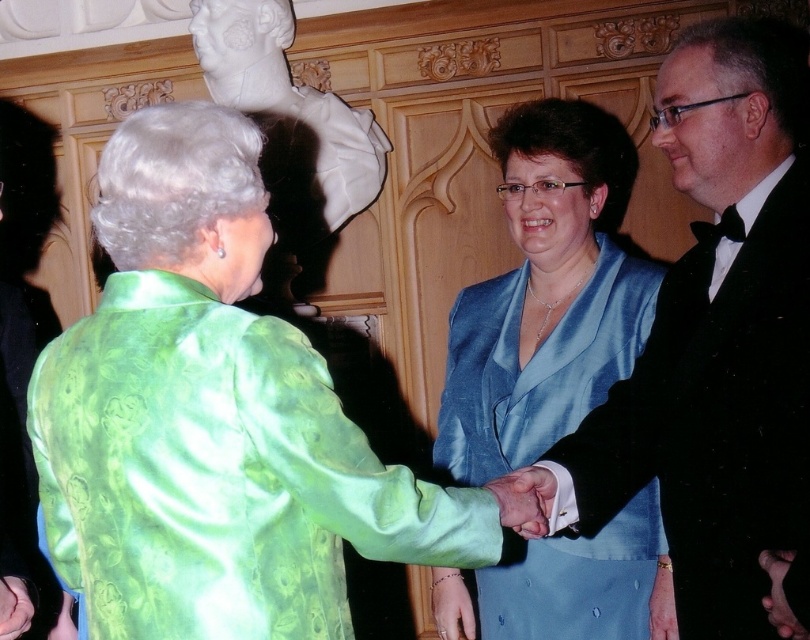
Does dark skin hand at lower right have a smaller size compared to smooth skin hand at lower left?

Correct, dark skin hand at lower right occupies less space than smooth skin hand at lower left.

Who is higher up, dark skin hand at lower right or smooth skin hand at lower left?

dark skin hand at lower right

This screenshot has width=810, height=640. In order to click on dark skin hand at lower right in this screenshot , I will do coord(779,595).

You are a GUI agent. You are given a task and a screenshot of the screen. Output one action in this format:
    pyautogui.click(x=<x>, y=<y>)
    Task: Click on the dark skin hand at lower right
    The width and height of the screenshot is (810, 640).
    Given the screenshot: What is the action you would take?
    pyautogui.click(x=779, y=595)

Between green satin blouse at center and dark skin hand at lower right, which one is positioned lower?

dark skin hand at lower right

I want to click on green satin blouse at center, so click(212, 419).

Who is more distant from viewer, (237, 410) or (783, 563)?

The point (783, 563) is behind.

Locate an element on the screen. green satin blouse at center is located at coordinates (212, 419).

Does satin blue dress at center come behind smooth skin hand at lower left?

No, satin blue dress at center is in front of smooth skin hand at lower left.

Does satin blue dress at center have a greater width compared to smooth skin hand at lower left?

Indeed, satin blue dress at center has a greater width compared to smooth skin hand at lower left.

Where is `satin blue dress at center`? This screenshot has width=810, height=640. satin blue dress at center is located at coordinates (544, 294).

Where is `satin blue dress at center`? satin blue dress at center is located at coordinates tap(544, 294).